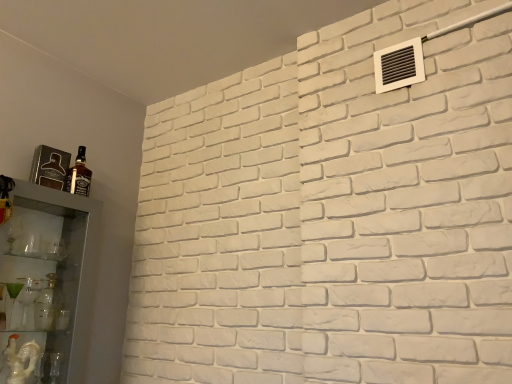
Image resolution: width=512 pixels, height=384 pixels. I want to click on matte glass bottle at left, so click(79, 175).

Find the location of `white plastic vent at upper right`. white plastic vent at upper right is located at coordinates (399, 65).

Which of these two, clear glass cabinet at left or white plastic vent at upper right, stands taller?

Standing taller between the two is clear glass cabinet at left.

Is white plastic vent at upper right inside clear glass cabinet at left?

That's incorrect, white plastic vent at upper right is not inside clear glass cabinet at left.

Considering the relative sizes of clear glass cabinet at left and white plastic vent at upper right in the image provided, is clear glass cabinet at left bigger than white plastic vent at upper right?

Yes, clear glass cabinet at left is bigger than white plastic vent at upper right.

Which object is closer to the camera, matte glass bottle at left or clear glass cabinet at left?

clear glass cabinet at left is in front.

Is matte glass bottle at left looking in the opposite direction of clear glass cabinet at left?

matte glass bottle at left does not have its back to clear glass cabinet at left.

Would you consider matte glass bottle at left to be distant from clear glass cabinet at left?

No, matte glass bottle at left is in close proximity to clear glass cabinet at left.

Based on their sizes in the image, would you say matte glass bottle at left is bigger or smaller than clear glass cabinet at left?

In the image, matte glass bottle at left appears to be smaller than clear glass cabinet at left.

Which is nearer, (380,69) or (78,177)?

Clearly, point (380,69) is closer to the camera than point (78,177).

Which of these two, white plastic vent at upper right or matte glass bottle at left, is thinner?

Thinner between the two is white plastic vent at upper right.

Is white plastic vent at upper right next to matte glass bottle at left and touching it?

white plastic vent at upper right is not next to matte glass bottle at left, and they're not touching.

Considering the sizes of objects white plastic vent at upper right and matte glass bottle at left in the image provided, who is shorter, white plastic vent at upper right or matte glass bottle at left?

white plastic vent at upper right.

In the scene shown: In terms of height, does white plastic vent at upper right look taller or shorter compared to clear glass cabinet at left?

Clearly, white plastic vent at upper right is shorter compared to clear glass cabinet at left.

Measure the distance from white plastic vent at upper right to clear glass cabinet at left.

white plastic vent at upper right is 4.70 feet from clear glass cabinet at left.

Considering the positions of objects white plastic vent at upper right and clear glass cabinet at left in the image provided, who is more to the left, white plastic vent at upper right or clear glass cabinet at left?

clear glass cabinet at left.

From the picture: Is white plastic vent at upper right facing towards clear glass cabinet at left?

No, white plastic vent at upper right is not oriented towards clear glass cabinet at left.

Considering the sizes of objects matte glass bottle at left and white plastic vent at upper right in the image provided, who is bigger, matte glass bottle at left or white plastic vent at upper right?

With larger size is white plastic vent at upper right.

From the image's perspective, which object appears higher, matte glass bottle at left or white plastic vent at upper right?

white plastic vent at upper right.

Between matte glass bottle at left and white plastic vent at upper right, which one has more height?

With more height is matte glass bottle at left.

Is white plastic vent at upper right at the back of matte glass bottle at left?

No, matte glass bottle at left's orientation is not away from white plastic vent at upper right.

Is clear glass cabinet at left turned away from matte glass bottle at left?

No, clear glass cabinet at left is not facing the opposite direction of matte glass bottle at left.

Considering the relative sizes of clear glass cabinet at left and matte glass bottle at left in the image provided, is clear glass cabinet at left wider than matte glass bottle at left?

Yes.

At what (x,y) coordinates should I click in order to perform the action: click on bottle above the clear glass cabinet at left (from a real-world perspective). Please return your answer as a coordinate pair (x, y). Looking at the image, I should click on (79, 175).

Find the location of a particular element. Image resolution: width=512 pixels, height=384 pixels. air conditioning that appears above the clear glass cabinet at left (from a real-world perspective) is located at coordinates (399, 65).

You are a GUI agent. You are given a task and a screenshot of the screen. Output one action in this format:
    pyautogui.click(x=<x>, y=<y>)
    Task: Click on the bottle behind the clear glass cabinet at left
    
    Given the screenshot: What is the action you would take?
    pyautogui.click(x=79, y=175)

Estimate the real-world distances between objects in this image. Which object is closer to clear glass cabinet at left, matte glass bottle at left or white plastic vent at upper right?

matte glass bottle at left.

From the image, which object appears to be farther from clear glass cabinet at left, white plastic vent at upper right or matte glass bottle at left?

white plastic vent at upper right lies further to clear glass cabinet at left than the other object.

From the image, which object appears to be nearer to matte glass bottle at left, white plastic vent at upper right or clear glass cabinet at left?

Among the two, clear glass cabinet at left is located nearer to matte glass bottle at left.

From the image, which object appears to be nearer to matte glass bottle at left, clear glass cabinet at left or white plastic vent at upper right?

clear glass cabinet at left.

Based on their spatial positions, is matte glass bottle at left or clear glass cabinet at left closer to white plastic vent at upper right?

The object closer to white plastic vent at upper right is matte glass bottle at left.

Looking at the image, which one is located further to white plastic vent at upper right, clear glass cabinet at left or matte glass bottle at left?

clear glass cabinet at left is positioned further to the anchor white plastic vent at upper right.

Locate an element on the screen. Image resolution: width=512 pixels, height=384 pixels. bottle between clear glass cabinet at left and white plastic vent at upper right in the horizontal direction is located at coordinates (79, 175).